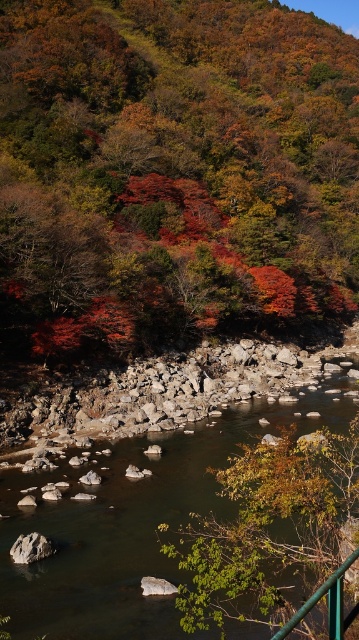
Can you confirm if smooth rock stream at center is positioned above green leafy tree at lower center?

No, smooth rock stream at center is not above green leafy tree at lower center.

Who is more forward, (2, 557) or (252, 589)?

Positioned in front is point (252, 589).

Is point (117, 637) positioned behind point (240, 502)?

Yes.

You are a GUI agent. You are given a task and a screenshot of the screen. Output one action in this format:
    pyautogui.click(x=<x>, y=<y>)
    Task: Click on the smooth rock stream at center
    
    Given the screenshot: What is the action you would take?
    pyautogui.click(x=134, y=520)

The width and height of the screenshot is (359, 640). What do you see at coordinates (134, 520) in the screenshot?
I see `smooth rock stream at center` at bounding box center [134, 520].

Looking at this image, is smooth rock stream at center positioned behind green metal railing at lower right?

Yes.

Between point (204, 632) and point (309, 611), which one is positioned behind?

Point (204, 632)

Identify the location of smooth rock stream at center. The height and width of the screenshot is (640, 359). (134, 520).

Which is in front, point (315, 64) or point (156, 557)?

Point (156, 557)

Between autumn leaves at upper center and smooth rock stream at center, which one is positioned lower?

smooth rock stream at center is below.

Who is more distant from viewer, (47, 168) or (338, 394)?

The point (47, 168) is more distant.

Find the location of `autumn leaves at upper center`. autumn leaves at upper center is located at coordinates (174, 164).